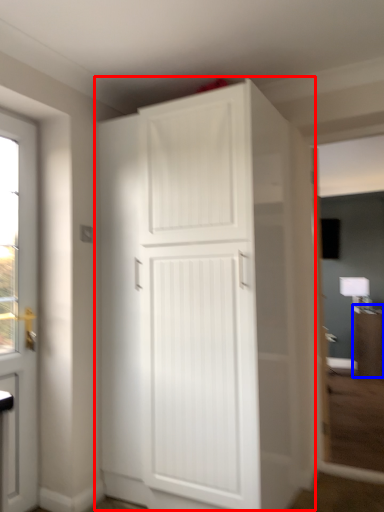
Question: Which of the following is the closest to the observer, cupboard (highlighted by a red box) or cabinetry (highlighted by a blue box)?

Choices:
 (A) cupboard
 (B) cabinetry

Answer: (A)